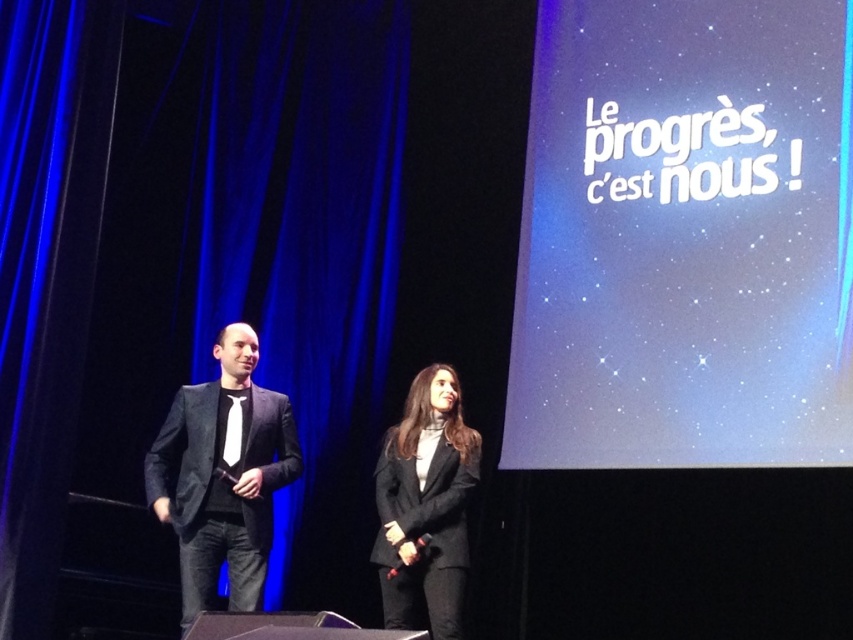
Can you confirm if blue velvet curtain at left is positioned to the left of matte white text at upper right?

Correct, you'll find blue velvet curtain at left to the left of matte white text at upper right.

Which is behind, point (367, 451) or point (612, 346)?

The point (367, 451) is more distant.

Find the location of a particular element. blue velvet curtain at left is located at coordinates (190, 259).

Which is more to the left, matte white text at upper right or matte black suit at left?

From the viewer's perspective, matte black suit at left appears more on the left side.

Can you confirm if matte white text at upper right is wider than matte black suit at left?

Indeed, matte white text at upper right has a greater width compared to matte black suit at left.

Where is `matte white text at upper right`? matte white text at upper right is located at coordinates (685, 237).

You are a GUI agent. You are given a task and a screenshot of the screen. Output one action in this format:
    pyautogui.click(x=<x>, y=<y>)
    Task: Click on the matte white text at upper right
    The image size is (853, 640).
    Given the screenshot: What is the action you would take?
    pyautogui.click(x=685, y=237)

Is point (300, 180) closer to camera compared to point (437, 520)?

That is False.

Is blue velvet curtain at left thinner than black matte blazer at center?

Correct, blue velvet curtain at left's width is less than black matte blazer at center's.

I want to click on blue velvet curtain at left, so click(x=190, y=259).